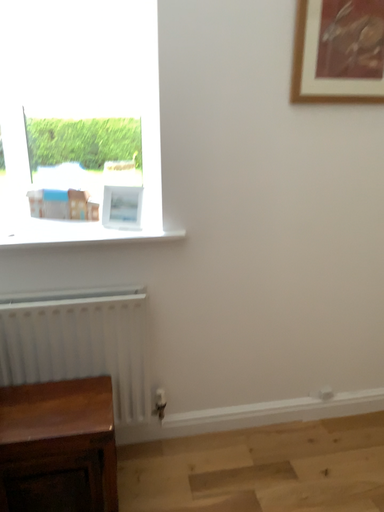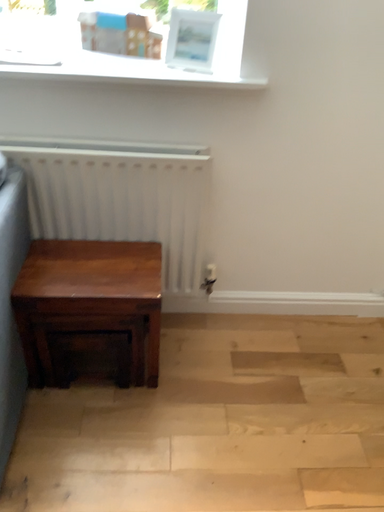
Question: How did the camera likely rotate when shooting the video?

Choices:
 (A) rotated right
 (B) rotated left

Answer: (B)